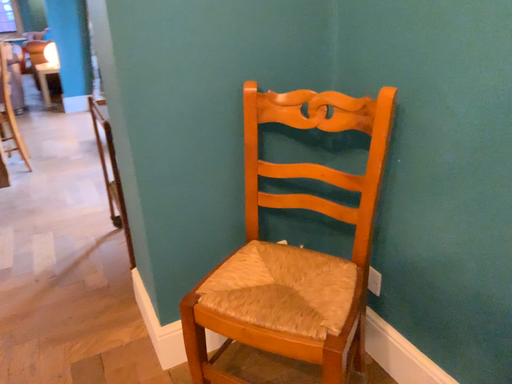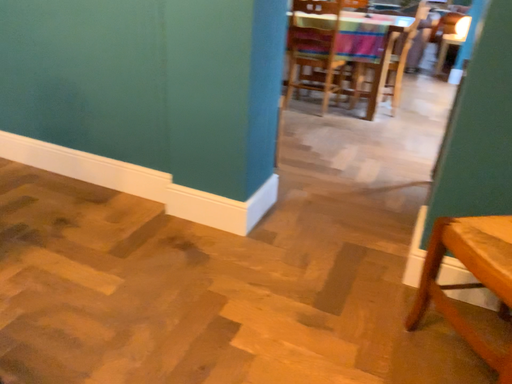
Question: How did the camera likely rotate when shooting the video?

Choices:
 (A) rotated upward
 (B) rotated downward

Answer: (A)